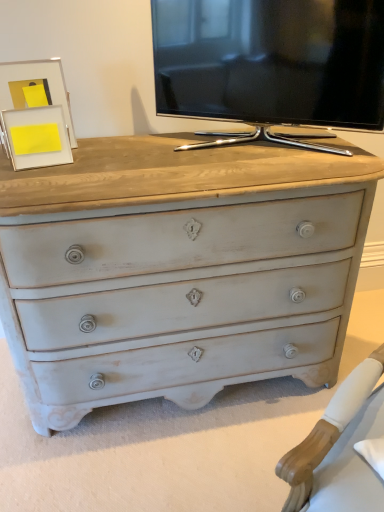
Find the location of a particular element. This screenshot has height=512, width=384. matte white picture frame at upper left, positioned as the 1th picture frame in back-to-front order is located at coordinates (36, 87).

The height and width of the screenshot is (512, 384). I want to click on matte white picture frame at upper left, positioned as the 1th picture frame in front-to-back order, so click(36, 137).

You are a GUI agent. You are given a task and a screenshot of the screen. Output one action in this format:
    pyautogui.click(x=<x>, y=<y>)
    Task: Click on the black glossy tv at upper center
    
    Given the screenshot: What is the action you would take?
    pyautogui.click(x=271, y=61)

This screenshot has width=384, height=512. I want to click on television above the matte white picture frame at upper left, positioned as the 1th picture frame in front-to-back order (from a real-world perspective), so click(x=271, y=61).

From a real-world perspective, which object rests below the other?

matte white picture frame at upper left, which appears as the second picture frame when viewed from the back.

From the image's perspective, is matte white picture frame at upper left, which appears as the second picture frame when viewed from the back, under black glossy tv at upper center?

Correct, matte white picture frame at upper left, which appears as the second picture frame when viewed from the back, appears lower than black glossy tv at upper center in the image.

Does matte white picture frame at upper left, positioned as the 1th picture frame in front-to-back order, turn towards black glossy tv at upper center?

No, matte white picture frame at upper left, positioned as the 1th picture frame in front-to-back order, is not turned towards black glossy tv at upper center.

Is black glossy tv at upper center oriented towards matte white picture frame at upper left, positioned as the 1th picture frame in front-to-back order?

Yes, black glossy tv at upper center is aimed at matte white picture frame at upper left, positioned as the 1th picture frame in front-to-back order.

Consider the image. Between black glossy tv at upper center and matte white picture frame at upper left, positioned as the 1th picture frame in front-to-back order, which one appears on the right side from the viewer's perspective?

From the viewer's perspective, black glossy tv at upper center appears more on the right side.

Which is farther, (188, 5) or (43, 118)?

The point (188, 5) is more distant.

Does black glossy tv at upper center have a larger size compared to matte white picture frame at upper left, positioned as the 1th picture frame in front-to-back order?

Indeed, black glossy tv at upper center has a larger size compared to matte white picture frame at upper left, positioned as the 1th picture frame in front-to-back order.

Is matte white picture frame at upper left, positioned as the 1th picture frame in front-to-back order, thinner than matte white picture frame at upper left, positioned as the second picture frame in front-to-back order?

Yes.

Does matte white picture frame at upper left, positioned as the 1th picture frame in front-to-back order, turn towards matte white picture frame at upper left, positioned as the second picture frame in front-to-back order?

No, matte white picture frame at upper left, positioned as the 1th picture frame in front-to-back order, is not oriented towards matte white picture frame at upper left, positioned as the second picture frame in front-to-back order.

Can you confirm if matte white picture frame at upper left, positioned as the 1th picture frame in front-to-back order, is shorter than matte white picture frame at upper left, positioned as the second picture frame in front-to-back order?

Yes, matte white picture frame at upper left, positioned as the 1th picture frame in front-to-back order, is shorter than matte white picture frame at upper left, positioned as the second picture frame in front-to-back order.

Between matte white picture frame at upper left, positioned as the 1th picture frame in front-to-back order, and matte white picture frame at upper left, positioned as the second picture frame in front-to-back order, which one is positioned in front?

matte white picture frame at upper left, positioned as the 1th picture frame in front-to-back order, is in front.

From the image's perspective, which is below, matte white picture frame at upper left, positioned as the second picture frame in front-to-back order, or matte white picture frame at upper left, positioned as the 1th picture frame in front-to-back order?

matte white picture frame at upper left, positioned as the 1th picture frame in front-to-back order, is shown below in the image.

Could matte white picture frame at upper left, which appears as the second picture frame when viewed from the back, be considered to be inside matte white picture frame at upper left, positioned as the second picture frame in front-to-back order?

No, matte white picture frame at upper left, which appears as the second picture frame when viewed from the back, is located outside of matte white picture frame at upper left, positioned as the second picture frame in front-to-back order.

Measure the distance between matte white picture frame at upper left, positioned as the second picture frame in front-to-back order, and matte white picture frame at upper left, which appears as the second picture frame when viewed from the back.

matte white picture frame at upper left, positioned as the second picture frame in front-to-back order, is 8.18 centimeters away from matte white picture frame at upper left, which appears as the second picture frame when viewed from the back.

Considering the points (39, 79) and (2, 124), which point is behind, point (39, 79) or point (2, 124)?

Point (39, 79)

Can you confirm if black glossy tv at upper center is bigger than matte white picture frame at upper left, positioned as the 1th picture frame in back-to-front order?

Yes.

From the image's perspective, which one is positioned higher, black glossy tv at upper center or matte white picture frame at upper left, positioned as the 1th picture frame in back-to-front order?

From the image's view, black glossy tv at upper center is above.

Which object is further away from the camera taking this photo, black glossy tv at upper center or matte white picture frame at upper left, positioned as the 1th picture frame in back-to-front order?

matte white picture frame at upper left, positioned as the 1th picture frame in back-to-front order, is behind.

Does black glossy tv at upper center have a lesser width compared to matte white picture frame at upper left, positioned as the second picture frame in front-to-back order?

No, black glossy tv at upper center is not thinner than matte white picture frame at upper left, positioned as the second picture frame in front-to-back order.

Could you tell me if matte white picture frame at upper left, positioned as the 1th picture frame in back-to-front order, is facing black glossy tv at upper center?

No, matte white picture frame at upper left, positioned as the 1th picture frame in back-to-front order, is not aimed at black glossy tv at upper center.

Consider the image. Is matte white picture frame at upper left, positioned as the 1th picture frame in back-to-front order, behind black glossy tv at upper center?

Yes, it is.

Which object is positioned more to the right, matte white picture frame at upper left, positioned as the 1th picture frame in back-to-front order, or black glossy tv at upper center?

Positioned to the right is black glossy tv at upper center.

Considering the positions of point (59, 85) and point (167, 103), is point (59, 85) closer or farther from the camera than point (167, 103)?

Point (59, 85) appears to be closer to the viewer than point (167, 103).

The image size is (384, 512). I want to click on television located in front of the matte white picture frame at upper left, positioned as the 1th picture frame in front-to-back order, so click(271, 61).

Where is `picture frame that is the 1st one when counting leftward from the black glossy tv at upper center`? The image size is (384, 512). picture frame that is the 1st one when counting leftward from the black glossy tv at upper center is located at coordinates (36, 137).

Considering their positions, is matte white picture frame at upper left, positioned as the second picture frame in front-to-back order, positioned further to matte white picture frame at upper left, positioned as the 1th picture frame in front-to-back order, than black glossy tv at upper center?

black glossy tv at upper center.

Looking at the image, which one is located closer to matte white picture frame at upper left, positioned as the second picture frame in front-to-back order, black glossy tv at upper center or matte white picture frame at upper left, positioned as the 1th picture frame in front-to-back order?

Among the two, matte white picture frame at upper left, positioned as the 1th picture frame in front-to-back order, is located nearer to matte white picture frame at upper left, positioned as the second picture frame in front-to-back order.

From the image, which object appears to be nearer to matte white picture frame at upper left, positioned as the second picture frame in front-to-back order, matte white picture frame at upper left, which appears as the second picture frame when viewed from the back, or black glossy tv at upper center?

matte white picture frame at upper left, which appears as the second picture frame when viewed from the back, lies closer to matte white picture frame at upper left, positioned as the second picture frame in front-to-back order, than the other object.

Estimate the real-world distances between objects in this image. Which object is closer to black glossy tv at upper center, matte white picture frame at upper left, which appears as the second picture frame when viewed from the back, or matte white picture frame at upper left, positioned as the second picture frame in front-to-back order?

matte white picture frame at upper left, positioned as the second picture frame in front-to-back order.

Based on their spatial positions, is matte white picture frame at upper left, positioned as the second picture frame in front-to-back order, or matte white picture frame at upper left, positioned as the 1th picture frame in front-to-back order, further from black glossy tv at upper center?

The object further to black glossy tv at upper center is matte white picture frame at upper left, positioned as the 1th picture frame in front-to-back order.

Looking at the image, which one is located closer to matte white picture frame at upper left, which appears as the second picture frame when viewed from the back, black glossy tv at upper center or matte white picture frame at upper left, positioned as the second picture frame in front-to-back order?

matte white picture frame at upper left, positioned as the second picture frame in front-to-back order, lies closer to matte white picture frame at upper left, which appears as the second picture frame when viewed from the back, than the other object.

You are a GUI agent. You are given a task and a screenshot of the screen. Output one action in this format:
    pyautogui.click(x=<x>, y=<y>)
    Task: Click on the picture frame between matte white picture frame at upper left, positioned as the 1th picture frame in back-to-front order, and black glossy tv at upper center, in the horizontal direction
    Image resolution: width=384 pixels, height=512 pixels.
    Given the screenshot: What is the action you would take?
    pyautogui.click(x=36, y=137)